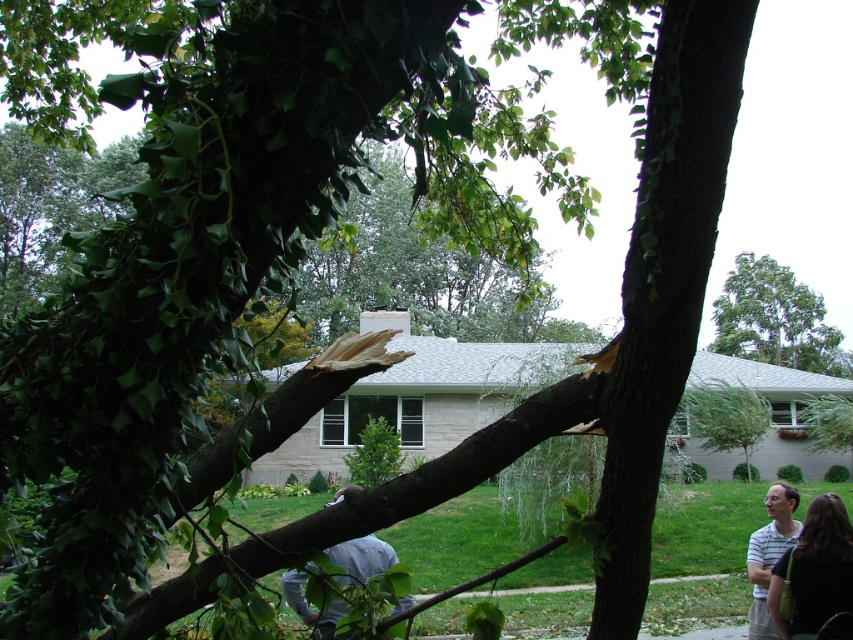
You are organizing a charity clothing drive and have two shirts to sort. The light gray fabric shirt at lower center and the striped cotton shirt at lower right. Which shirt has a greater width?

The light gray fabric shirt at lower center has a greater width than the striped cotton shirt at lower right.